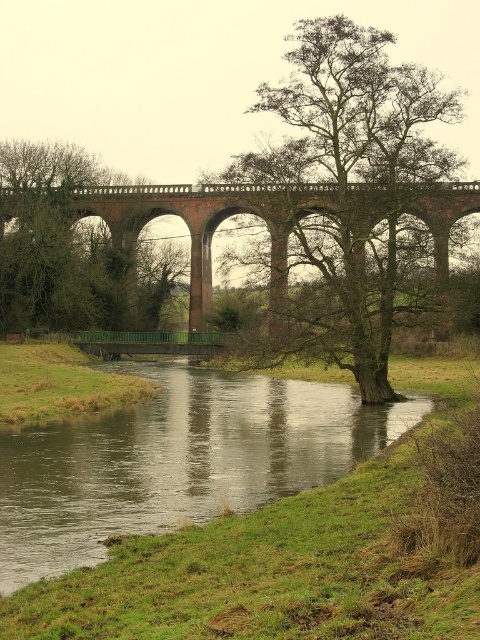
You are standing at the point marked by the coordinates point (354, 192). Looking towards the green leafy tree at center, which direction should you face to see the arched brick viaduct spanning across the river?

The green leafy tree at center is located at point (354, 192). Since the viaduct spans the river and the tree is at the center, facing away from the tree towards the viaduct would allow you to see the arched brick viaduct spanning across the river.

You are a photographer positioned on the brick arch bridge at center. You want to take a photo of the green leafy tree at center. Is the tree visible in your current position?

The green leafy tree at center is in front of the brick arch bridge at center, so yes, the tree is visible from your position on the bridge.

You are a photographer planning to capture the entire green grassy river at center and the green leafy tree at left in one frame. Which object should you focus on first to ensure both are in the frame?

Since the green grassy river at center is bigger than the green leafy tree at left, you should focus on the green grassy river at center first to ensure both fit in the frame.